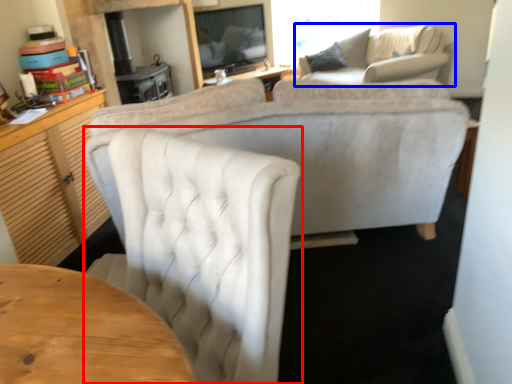
Question: Which object appears closest to the camera in this image, chair (highlighted by a red box) or studio couch (highlighted by a blue box)?

Choices:
 (A) chair
 (B) studio couch

Answer: (A)